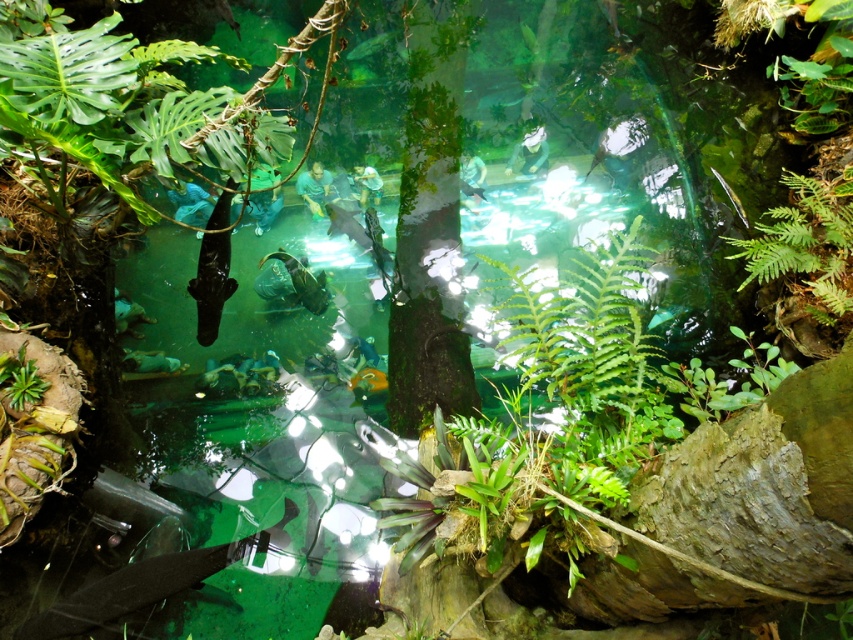
Does green textured tree at center have a lesser height compared to green translucent fish at center?

Incorrect, green textured tree at center's height does not fall short of green translucent fish at center's.

Is green textured tree at center taller than green translucent fish at center?

Correct, green textured tree at center is much taller as green translucent fish at center.

Is point (419, 100) farther from viewer compared to point (381, 35)?

No, (419, 100) is closer to viewer.

Where is `green textured tree at center`? This screenshot has height=640, width=853. green textured tree at center is located at coordinates (430, 227).

Is green textured tree at center positioned at the back of shiny black fish at center-left?

That is False.

Is point (453, 68) less distant than point (213, 336)?

No, it is behind (213, 336).

Image resolution: width=853 pixels, height=640 pixels. In order to click on green textured tree at center in this screenshot , I will do (x=430, y=227).

Between point (198, 330) and point (363, 52), which one is positioned in front?

Point (198, 330) is more forward.

Does shiny black fish at center-left appear under green translucent fish at center?

Indeed, shiny black fish at center-left is positioned under green translucent fish at center.

I want to click on shiny black fish at center-left, so click(x=212, y=284).